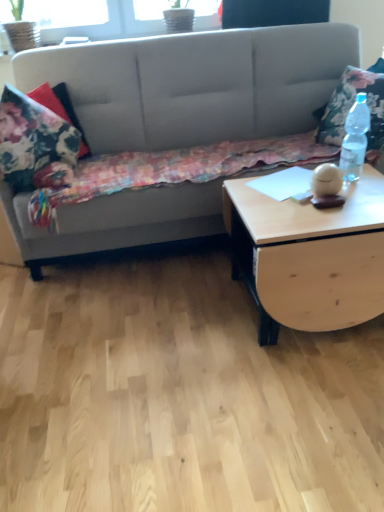
Question: Considering the relative positions of light wood/texture coffee table at right and floral fabric blanket at left in the image provided, is light wood/texture coffee table at right to the left of floral fabric blanket at left from the viewer's perspective?

Choices:
 (A) yes
 (B) no

Answer: (B)

Question: Are light wood/texture coffee table at right and floral fabric blanket at left located far from each other?

Choices:
 (A) no
 (B) yes

Answer: (A)

Question: From a real-world perspective, is light wood/texture coffee table at right under floral fabric blanket at left?

Choices:
 (A) no
 (B) yes

Answer: (B)

Question: Is light wood/texture coffee table at right taller than floral fabric blanket at left?

Choices:
 (A) no
 (B) yes

Answer: (B)

Question: Can floral fabric blanket at left be found inside light wood/texture coffee table at right?

Choices:
 (A) yes
 (B) no

Answer: (B)

Question: Visually, is clear plastic bottle at right positioned to the left or to the right of suede gray couch at upper left?

Choices:
 (A) left
 (B) right

Answer: (B)

Question: From the image's perspective, relative to suede gray couch at upper left, is clear plastic bottle at right above or below?

Choices:
 (A) below
 (B) above

Answer: (A)

Question: From a real-world perspective, is clear plastic bottle at right physically located above or below suede gray couch at upper left?

Choices:
 (A) below
 (B) above

Answer: (B)

Question: Considering the positions of clear plastic bottle at right and suede gray couch at upper left in the image, is clear plastic bottle at right bigger or smaller than suede gray couch at upper left?

Choices:
 (A) small
 (B) big

Answer: (A)

Question: Is floral fabric pillow at left inside or outside of light wood/texture coffee table at right?

Choices:
 (A) inside
 (B) outside

Answer: (B)

Question: From a real-world perspective, is floral fabric pillow at left positioned above or below light wood/texture coffee table at right?

Choices:
 (A) below
 (B) above

Answer: (B)

Question: Based on their sizes in the image, would you say floral fabric pillow at left is bigger or smaller than light wood/texture coffee table at right?

Choices:
 (A) small
 (B) big

Answer: (A)

Question: Considering the relative positions of floral fabric pillow at left and light wood/texture coffee table at right in the image provided, is floral fabric pillow at left to the left or to the right of light wood/texture coffee table at right?

Choices:
 (A) left
 (B) right

Answer: (A)

Question: Looking at their shapes, would you say floral fabric pillow at right is wider or thinner than suede gray couch at upper left?

Choices:
 (A) thin
 (B) wide

Answer: (A)

Question: Based on their sizes in the image, would you say floral fabric pillow at right is bigger or smaller than suede gray couch at upper left?

Choices:
 (A) big
 (B) small

Answer: (B)